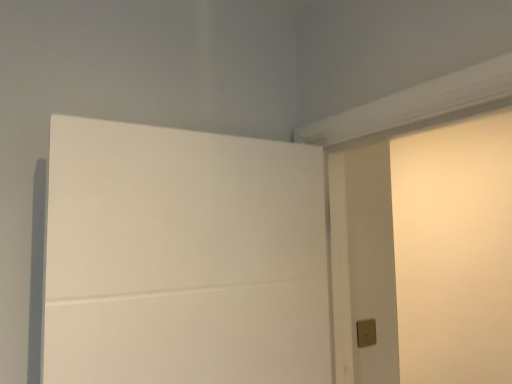
Question: Can you confirm if matte beige light switch at lower right is wider than white matte door at upper left?

Choices:
 (A) yes
 (B) no

Answer: (B)

Question: Can you confirm if matte beige light switch at lower right is taller than white matte door at upper left?

Choices:
 (A) yes
 (B) no

Answer: (B)

Question: Does matte beige light switch at lower right have a smaller size compared to white matte door at upper left?

Choices:
 (A) yes
 (B) no

Answer: (A)

Question: Is matte beige light switch at lower right to the right of white matte door at upper left from the viewer's perspective?

Choices:
 (A) no
 (B) yes

Answer: (B)

Question: Is the depth of matte beige light switch at lower right less than that of white matte door at upper left?

Choices:
 (A) no
 (B) yes

Answer: (A)

Question: Is matte beige light switch at lower right far away from white matte door at upper left?

Choices:
 (A) no
 (B) yes

Answer: (A)

Question: Is matte beige light switch at lower right at the back of white matte door at upper left?

Choices:
 (A) yes
 (B) no

Answer: (B)

Question: Is matte beige light switch at lower right a part of white matte door at upper left?

Choices:
 (A) yes
 (B) no

Answer: (B)

Question: Can you confirm if white matte door at upper left is wider than matte beige light switch at lower right?

Choices:
 (A) no
 (B) yes

Answer: (B)

Question: From a real-world perspective, is white matte door at upper left on matte beige light switch at lower right?

Choices:
 (A) yes
 (B) no

Answer: (A)

Question: Considering the relative positions of white matte door at upper left and matte beige light switch at lower right in the image provided, is white matte door at upper left behind matte beige light switch at lower right?

Choices:
 (A) yes
 (B) no

Answer: (B)

Question: From the image's perspective, does white matte door at upper left appear lower than matte beige light switch at lower right?

Choices:
 (A) yes
 (B) no

Answer: (B)

Question: Considering the positions of white matte door at upper left and matte beige light switch at lower right in the image, is white matte door at upper left taller or shorter than matte beige light switch at lower right?

Choices:
 (A) short
 (B) tall

Answer: (B)